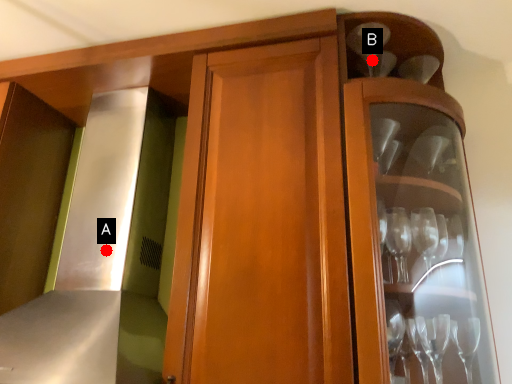
Question: Two points are circled on the image, labeled by A and B beside each circle. Which point is closer to the camera?

Choices:
 (A) A is closer
 (B) B is closer

Answer: (B)